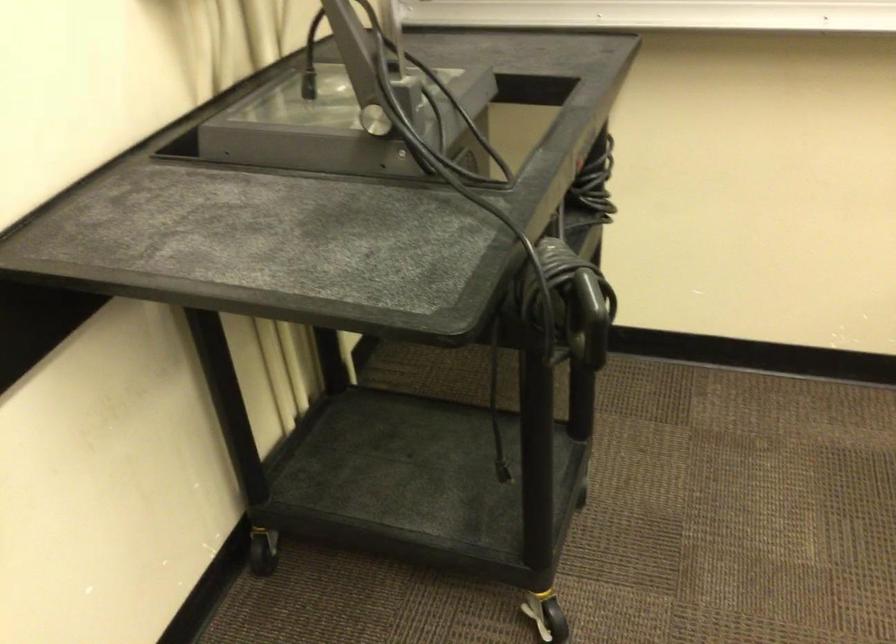
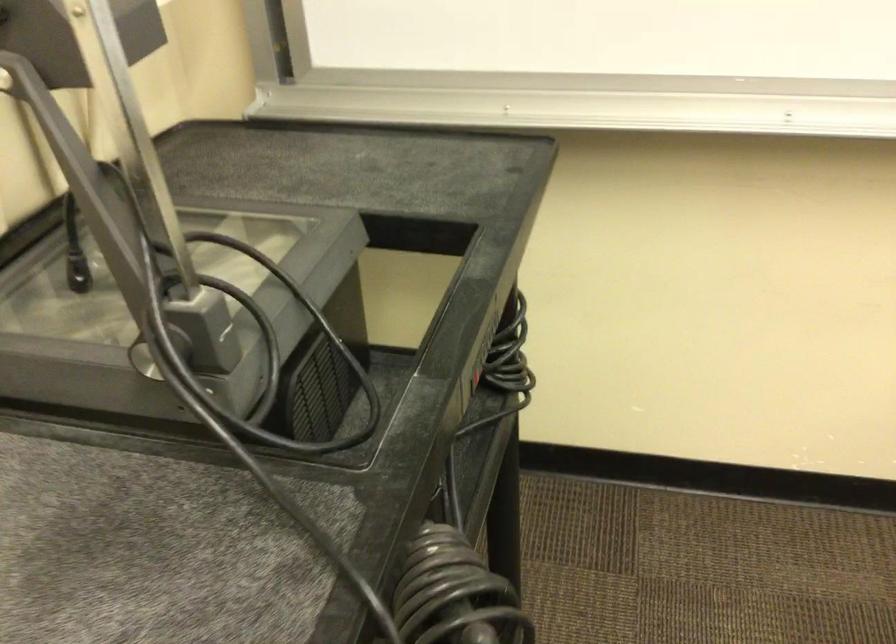
Question: The images are taken continuously from a first-person perspective. In which direction are you moving?

Choices:
 (A) Left
 (B) Right
 (C) Forward
 (D) Backward

Answer: (C)